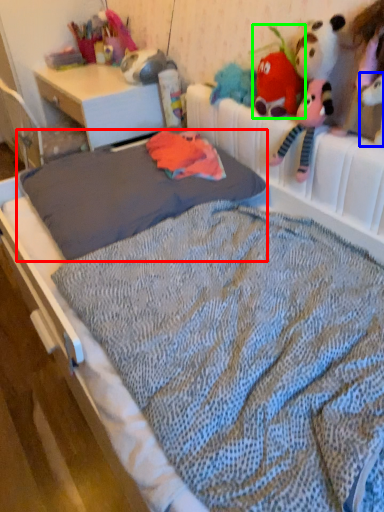
Question: Which object is the closest to the mattress (highlighted by a red box)? Choose among these: toy (highlighted by a blue box) or toy (highlighted by a green box).

Choices:
 (A) toy
 (B) toy

Answer: (B)